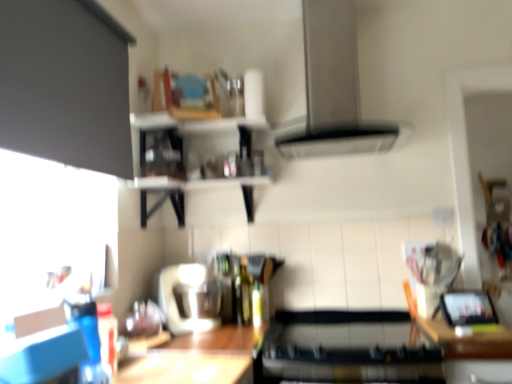
Image resolution: width=512 pixels, height=384 pixels. I want to click on free location above wooden table at lower center (from a real-world perspective), so click(x=176, y=365).